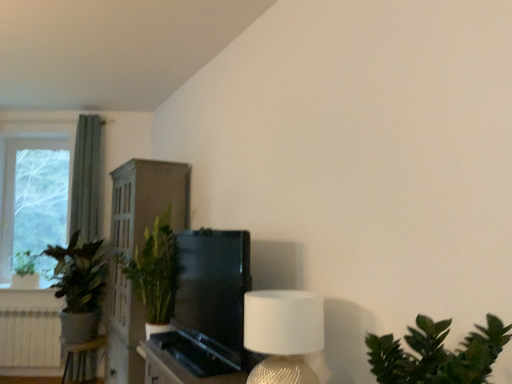
Question: Should I look upward or downward to see green leafy plant at left, which ranks as the 2th houseplant in back-to-front order?

Choices:
 (A) up
 (B) down

Answer: (B)

Question: Considering the relative sizes of green matte plant at left, positioned as the first houseplant in back-to-front order, and white textured lampshade at upper right in the image provided, is green matte plant at left, positioned as the first houseplant in back-to-front order, wider than white textured lampshade at upper right?

Choices:
 (A) yes
 (B) no

Answer: (A)

Question: Is green matte plant at left, the third houseplant viewed from the right, facing away from white textured lampshade at upper right?

Choices:
 (A) no
 (B) yes

Answer: (A)

Question: From a real-world perspective, is green matte plant at left, positioned as the first houseplant in back-to-front order, physically above white textured lampshade at upper right?

Choices:
 (A) no
 (B) yes

Answer: (B)

Question: Is green matte plant at left, the 3th houseplant positioned from the front, next to white textured lampshade at upper right and touching it?

Choices:
 (A) no
 (B) yes

Answer: (A)

Question: Is green matte plant at left, the 3th houseplant positioned from the front, facing towards white textured lampshade at upper right?

Choices:
 (A) yes
 (B) no

Answer: (B)

Question: From the image's perspective, would you say green matte plant at left, the third houseplant viewed from the right, is shown under white textured lampshade at upper right?

Choices:
 (A) yes
 (B) no

Answer: (A)

Question: Considering the relative sizes of clear glass window at left and green leafy plant at lower right, which ranks as the 3th houseplant in left-to-right order, in the image provided, is clear glass window at left taller than green leafy plant at lower right, which ranks as the 3th houseplant in left-to-right order,?

Choices:
 (A) no
 (B) yes

Answer: (B)

Question: Is clear glass window at left oriented towards green leafy plant at lower right, which is the first houseplant from right to left?

Choices:
 (A) no
 (B) yes

Answer: (A)

Question: Is clear glass window at left completely or partially outside of green leafy plant at lower right, the first houseplant when ordered from front to back?

Choices:
 (A) no
 (B) yes

Answer: (B)

Question: Can you confirm if clear glass window at left is wider than green leafy plant at lower right, which is counted as the 3th houseplant, starting from the back?

Choices:
 (A) no
 (B) yes

Answer: (A)

Question: From the image's perspective, would you say clear glass window at left is shown under green leafy plant at lower right, the first houseplant when ordered from front to back?

Choices:
 (A) no
 (B) yes

Answer: (A)

Question: Is clear glass window at left directly adjacent to green leafy plant at lower right, the first houseplant when ordered from front to back?

Choices:
 (A) yes
 (B) no

Answer: (B)

Question: From the image's perspective, would you say green matte plant at left, the 3th houseplant positioned from the front, is positioned over green leafy plant at left, the second houseplant positioned from the front?

Choices:
 (A) yes
 (B) no

Answer: (A)